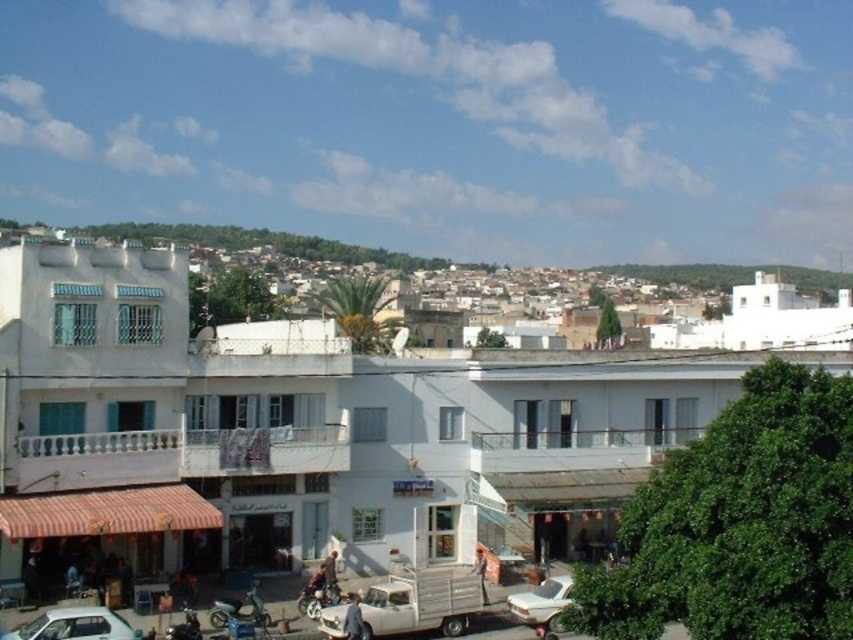
Is point (527, 612) farther from camera compared to point (250, 588)?

That is False.

Find the location of `white glossy car at lower right`. white glossy car at lower right is located at coordinates (543, 602).

Between white matte building at center and metallic blue motorcycle at lower center, which one has more height?

With more height is white matte building at center.

Is point (65, 352) closer to viewer compared to point (234, 608)?

No, (65, 352) is further to viewer.

Is point (45, 241) farther from camera compared to point (210, 620)?

That is True.

Identify the location of white matte building at center. This screenshot has height=640, width=853. (281, 429).

Which is more to the right, white glossy car at lower right or metallic silver motorcycle at center?

Positioned to the right is white glossy car at lower right.

Consider the image. Does white glossy car at lower right have a greater height compared to metallic silver motorcycle at center?

Indeed, white glossy car at lower right has a greater height compared to metallic silver motorcycle at center.

You are a GUI agent. You are given a task and a screenshot of the screen. Output one action in this format:
    pyautogui.click(x=<x>, y=<y>)
    Task: Click on the white glossy car at lower right
    
    Given the screenshot: What is the action you would take?
    pyautogui.click(x=543, y=602)